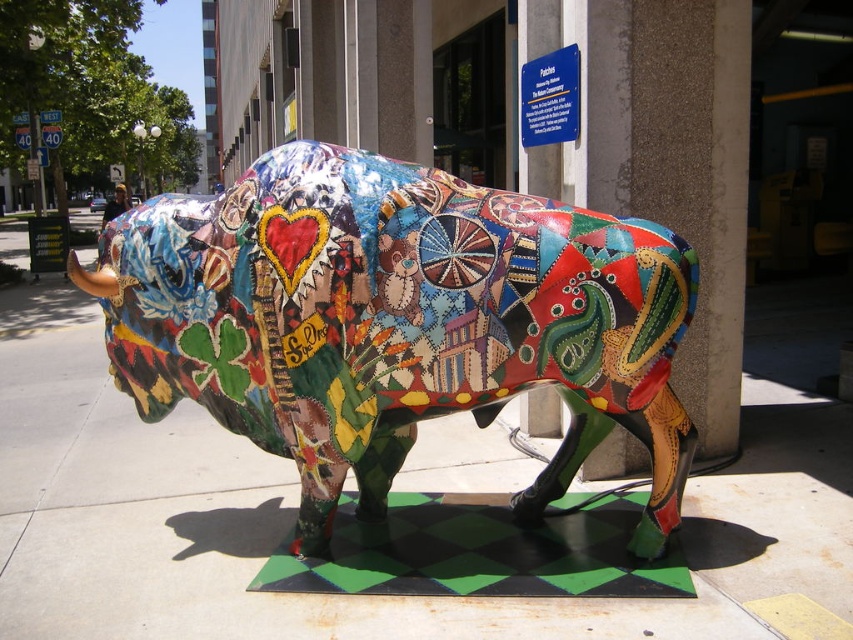
You are an artist planning to paint a mural inspired by the multicolored mosaic bull at center. To ensure accuracy, you need to know its exact position relative to the checkered base. Can you determine if the bull is centered on the base or shifted to one side?

The multicolored mosaic bull at center is located at point coordinates approximately 0.503 on the x and 0.465 on the y axis. Since the x coordinate is very close to 0.5, which typically represents the center point in such coordinate systems, the bull is nearly centered horizontally. However, the y coordinate at 0.465 is slightly below the vertical midpoint, indicating a minor shift downward. Therefore, the bull is mostly centered on the base but slightly shifted downward.

You are standing at the point marked as point (274, 200). The bull sculpture is 2.67 meters away from you. If you want to walk directly towards the bull sculpture, which direction should you move?

Since the bull sculpture is 2.67 meters away from point (274, 200), you should move in the direction towards the bull sculpture to reach it.